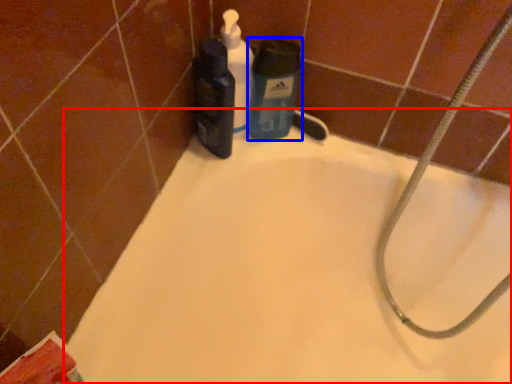
Question: Which of the following is the farthest to the observer, bathtub (highlighted by a red box) or cleaning product (highlighted by a blue box)?

Choices:
 (A) bathtub
 (B) cleaning product

Answer: (B)